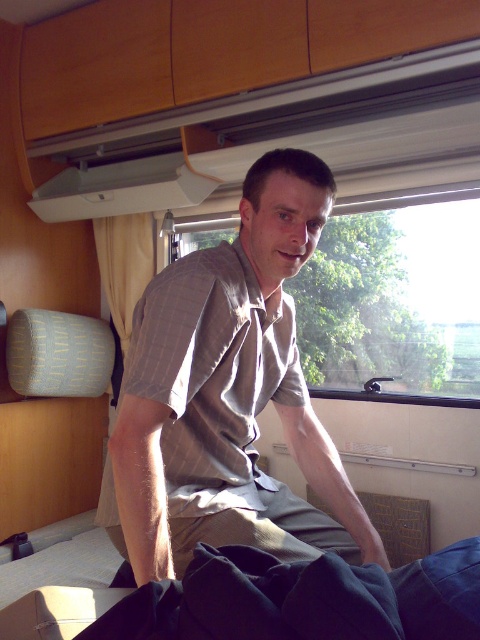
Can you confirm if gray striped shirt at center is smaller than transparent glass window at center?

Yes, gray striped shirt at center is smaller than transparent glass window at center.

Is the position of gray striped shirt at center more distant than that of transparent glass window at center?

That is False.

Locate an element on the screen. The width and height of the screenshot is (480, 640). gray striped shirt at center is located at coordinates (228, 396).

Find the location of `gray striped shirt at center`. gray striped shirt at center is located at coordinates (228, 396).